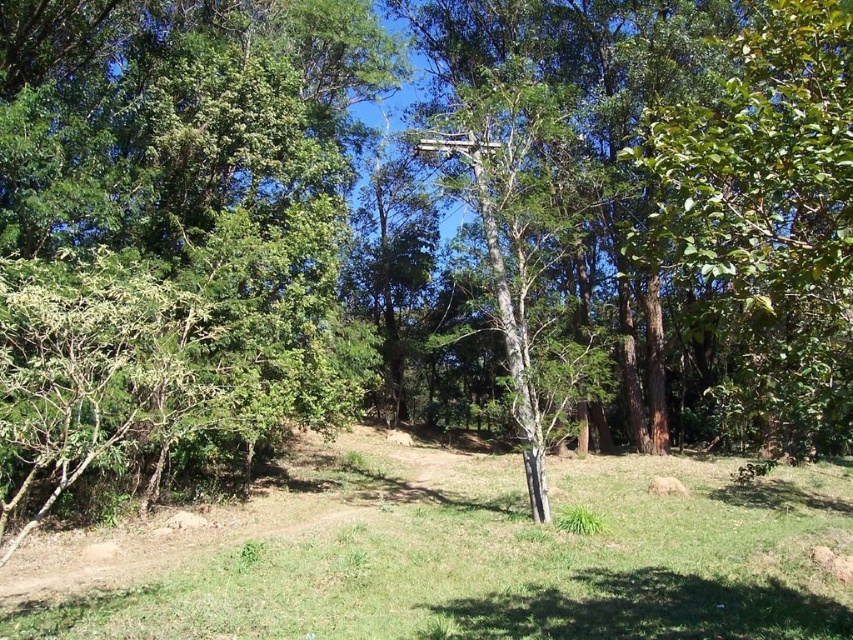
Between green grassy at center and white smooth birch tree at center, which one appears on the right side from the viewer's perspective?

white smooth birch tree at center is more to the right.

Is point (654, 592) positioned behind point (502, 88)?

No, it is not.

Does point (538, 550) lie in front of point (540, 436)?

Yes, it is.

Locate an element on the screen. This screenshot has width=853, height=640. green grassy at center is located at coordinates (456, 556).